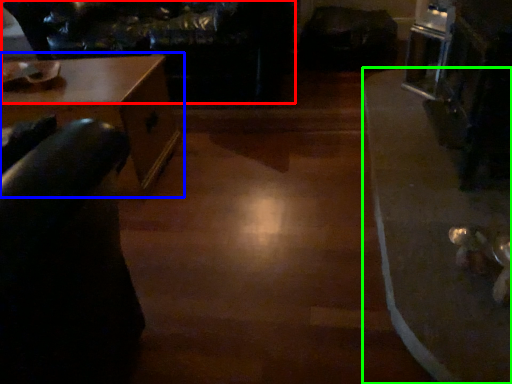
Question: Which object is the farthest from couch (highlighted by a red box)? Choose among these: table (highlighted by a blue box) or table (highlighted by a green box).

Choices:
 (A) table
 (B) table

Answer: (B)